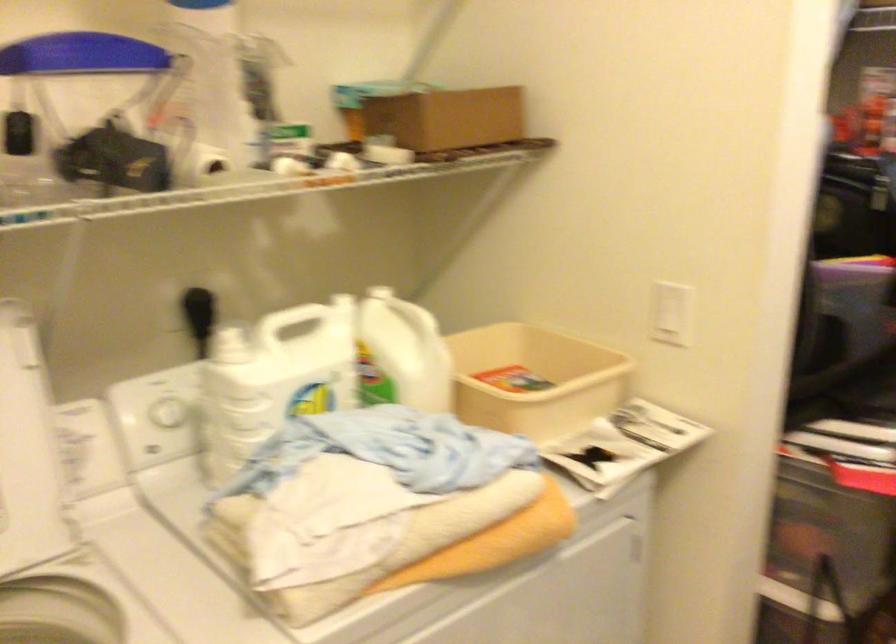
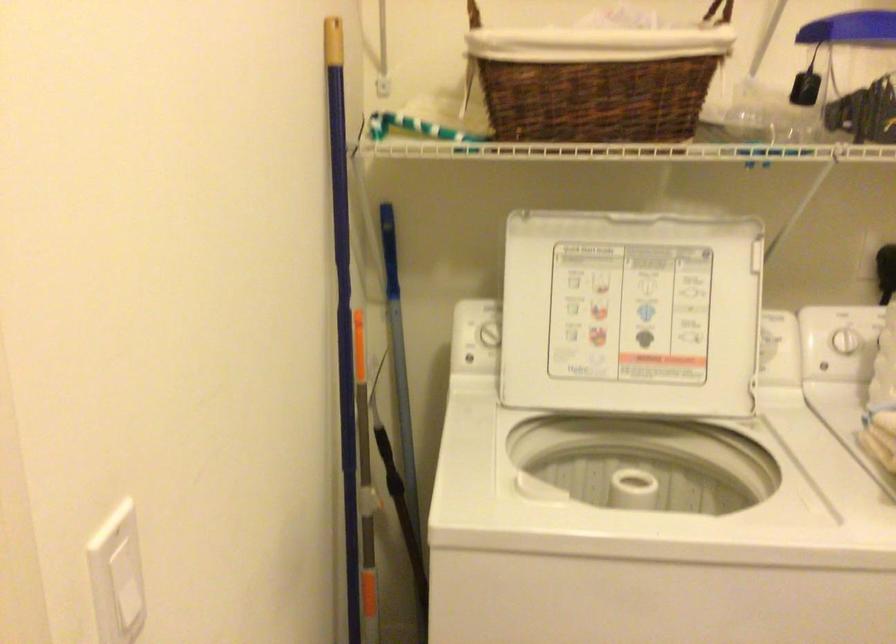
Find the pixel in the second image that matches [165,415] in the first image.

(845, 341)